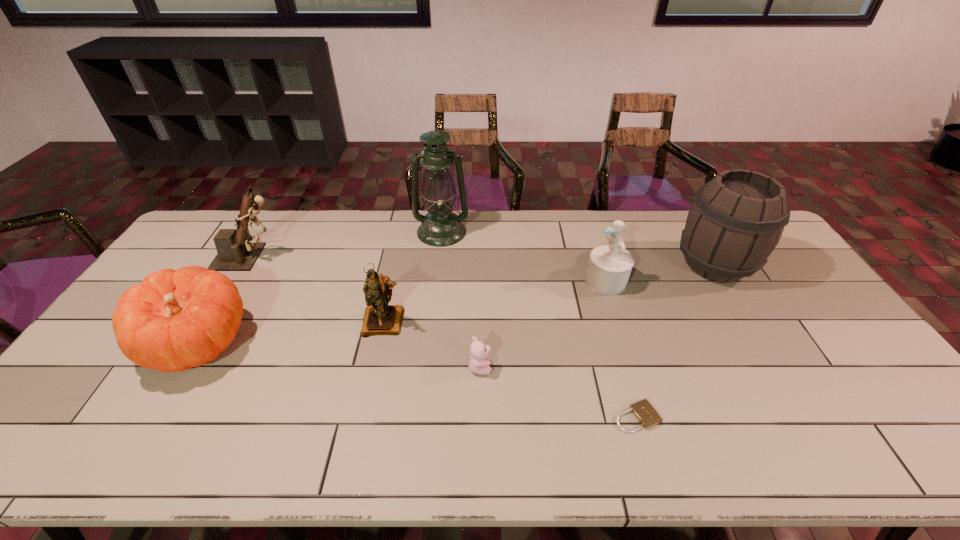
Locate an element on the screen. This screenshot has width=960, height=540. vacant area at the right edge is located at coordinates (867, 376).

I want to click on blank region between the shortest object and the leftmost figurine, so click(x=444, y=337).

The image size is (960, 540). I want to click on vacant region between the fourth object from right to left and the oil lamp, so [x=461, y=299].

Locate an element on the screen. The height and width of the screenshot is (540, 960). vacant area between the nearest figurine and the rightmost object is located at coordinates (549, 293).

Identify the location of free area in between the rightmost figurine and the tallest object. (524, 256).

The height and width of the screenshot is (540, 960). Identify the location of unoccupied position between the tallest object and the pumpkin. (320, 287).

Where is `vacant point located between the leftmost figurine and the oil lamp`? The width and height of the screenshot is (960, 540). vacant point located between the leftmost figurine and the oil lamp is located at coordinates (347, 245).

This screenshot has height=540, width=960. I want to click on vacant area that lies between the nearest object and the fourth object from right to left, so click(x=559, y=392).

You are a GUI agent. You are given a task and a screenshot of the screen. Output one action in this format:
    pyautogui.click(x=<x>, y=<y>)
    Task: Click on the unoccupied area between the nearest object and the pumpkin
    Image resolution: width=960 pixels, height=540 pixels.
    Given the screenshot: What is the action you would take?
    pyautogui.click(x=418, y=380)

I want to click on vacant point located between the oil lamp and the pumpkin, so click(320, 287).